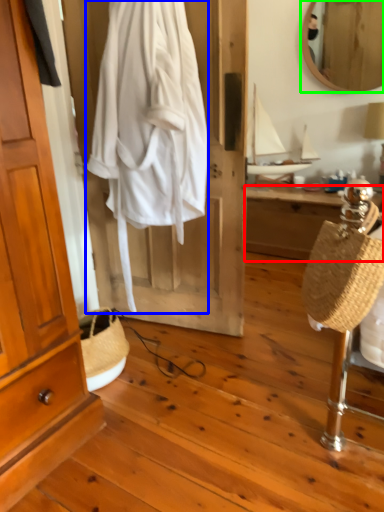
Question: Estimate the real-world distances between objects in this image. Which object is farther from desk (highlighted by a red box), clothing (highlighted by a blue box) or mirror (highlighted by a green box)?

Choices:
 (A) clothing
 (B) mirror

Answer: (A)